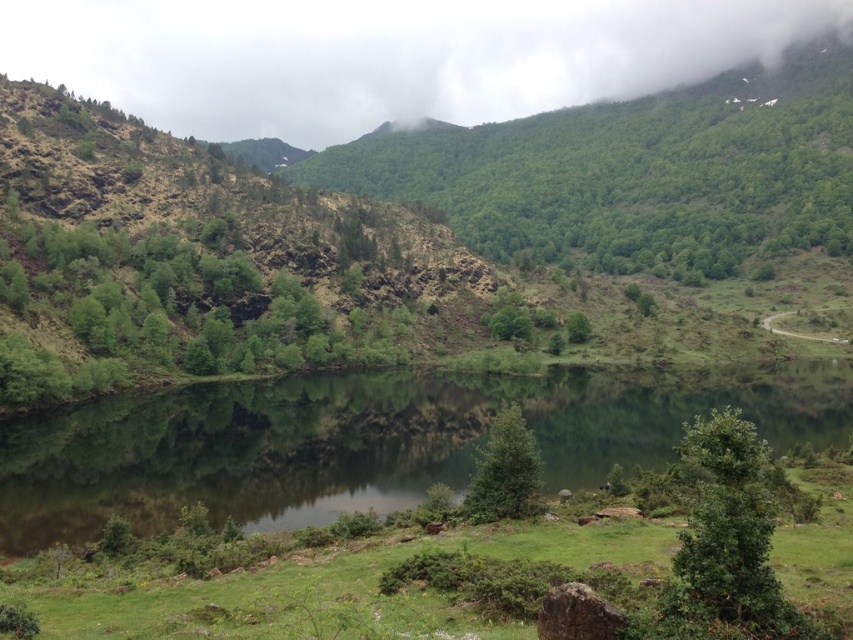
You are standing at the edge of the lake and see the green reflective water at center and the green leafy tree at center. Which object takes up more space in the image?

The green reflective water at center takes up more space in the image than the green leafy tree at center because it is bigger.

You are standing at the edge of the lake and see the green matte tree at center and the green leafy tree at center. Which tree is positioned more to the left side?

The green matte tree at center is positioned more to the left side than the green leafy tree at center.